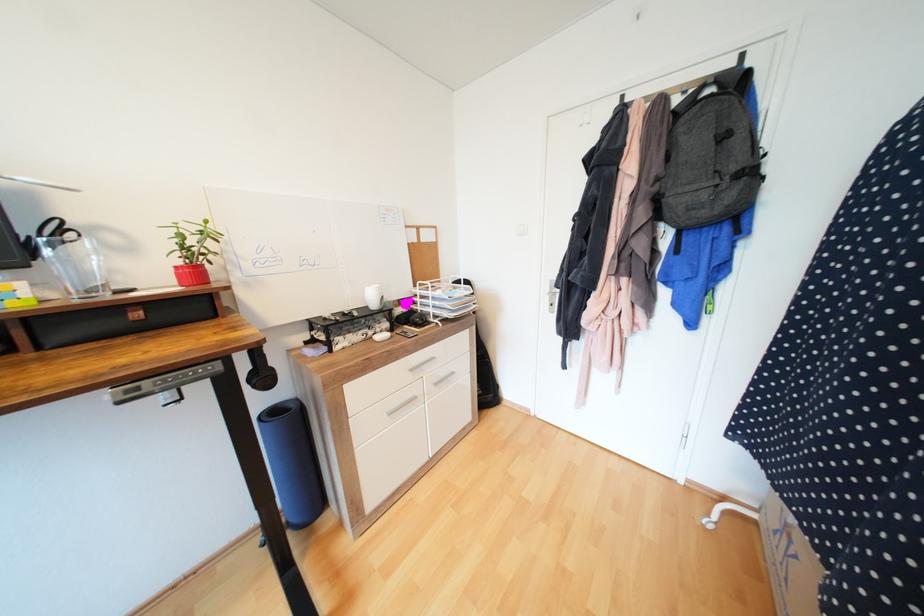
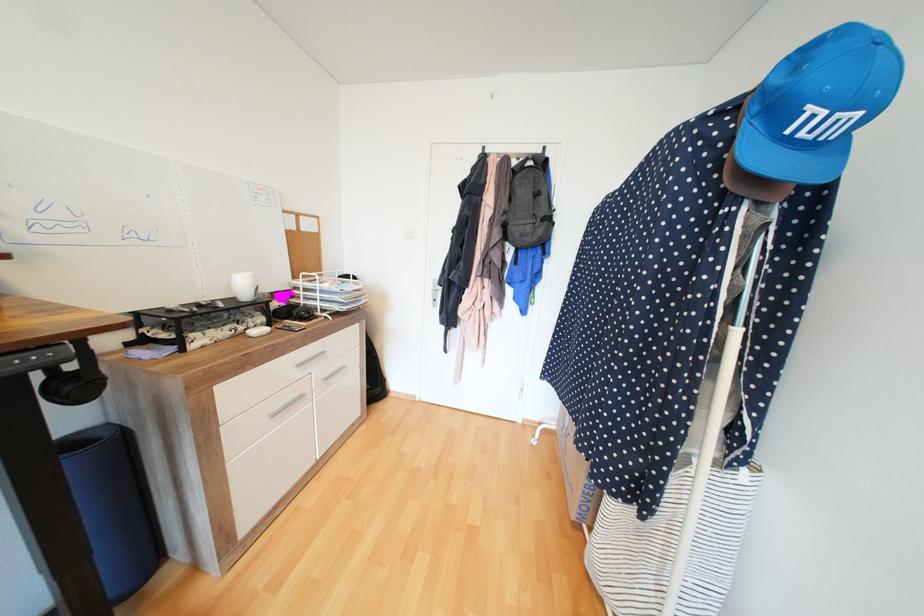
In the second image, find the point that corresponds to point 381,306 in the first image.

(251, 296)